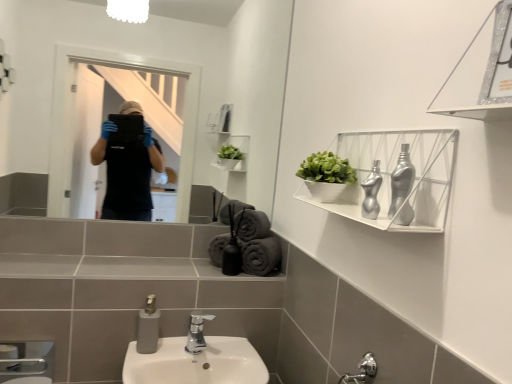
The width and height of the screenshot is (512, 384). What do you see at coordinates (481, 74) in the screenshot? I see `metallic silver shelf at upper right, marked as the 1th shelf in a front-to-back arrangement` at bounding box center [481, 74].

Measure the distance between point (435, 154) and camera.

The distance of point (435, 154) from camera is 33.31 inches.

Describe the element at coordinates (392, 176) in the screenshot. I see `white matte shelf at upper right, the first shelf viewed from the back` at that location.

What are the coordinates of `gray cotton bath towel at center, which ranks as the 4th bath towel in right-to-left order` in the screenshot? It's located at (218, 248).

At what (x,y) coordinates should I click in order to perform the action: click on gray matte bath towel at center, the 2th bath towel from the left. Please return your answer as a coordinate pair (x, y). Looking at the image, I should click on pyautogui.click(x=246, y=244).

You are a GUI agent. You are given a task and a screenshot of the screen. Output one action in this format:
    pyautogui.click(x=<x>, y=<y>)
    Task: Click on the polished chrome faucet at center
    Image resolution: width=512 pixels, height=384 pixels.
    Given the screenshot: What is the action you would take?
    pyautogui.click(x=197, y=332)

Identify the location of gray cotton bath towel at center, the third bath towel viewed from the left. Image resolution: width=512 pixels, height=384 pixels. (251, 225).

In order to face gray cotton bath towel at center, which is the 2th bath towel in right-to-left order, should I rotate leftwards or rightwards?

You should look left and rotate roughly 0.513 degrees.

The width and height of the screenshot is (512, 384). Find the location of `metallic silver shelf at upper right, marked as the 1th shelf in a front-to-back arrangement`. metallic silver shelf at upper right, marked as the 1th shelf in a front-to-back arrangement is located at coordinates point(481,74).

Based on their sizes in the image, would you say gray cotton bath towel at center, which ranks as the 4th bath towel in right-to-left order, is bigger or smaller than gray cotton towels at lower center, marked as the 1th bath towel in a right-to-left arrangement?

Considering their sizes, gray cotton bath towel at center, which ranks as the 4th bath towel in right-to-left order, takes up less space than gray cotton towels at lower center, marked as the 1th bath towel in a right-to-left arrangement.

Considering the relative sizes of gray cotton bath towel at center, which ranks as the 4th bath towel in right-to-left order, and gray cotton towels at lower center, the 4th bath towel viewed from the left, in the image provided, is gray cotton bath towel at center, which ranks as the 4th bath towel in right-to-left order, shorter than gray cotton towels at lower center, the 4th bath towel viewed from the left,?

Incorrect, the height of gray cotton bath towel at center, which ranks as the 4th bath towel in right-to-left order, does not fall short of that of gray cotton towels at lower center, the 4th bath towel viewed from the left.

Identify the location of the 1st bath towel above the gray cotton towels at lower center, marked as the 1th bath towel in a right-to-left arrangement (from the image's perspective). (218, 248).

Based on the photo, from the image's perspective, is gray cotton bath towel at center, acting as the first bath towel starting from the left, on gray cotton towels at lower center, marked as the 1th bath towel in a right-to-left arrangement?

Yes.

From a real-world perspective, is gray matte bath towel at center, which is the third bath towel from right to left, positioned above or below gray cotton towels at lower center, marked as the 1th bath towel in a right-to-left arrangement?

Clearly, from a real-world perspective, gray matte bath towel at center, which is the third bath towel from right to left, is above gray cotton towels at lower center, marked as the 1th bath towel in a right-to-left arrangement.

Between gray matte bath towel at center, which is the third bath towel from right to left, and gray cotton towels at lower center, marked as the 1th bath towel in a right-to-left arrangement, which one has larger width?

Wider between the two is gray cotton towels at lower center, marked as the 1th bath towel in a right-to-left arrangement.

Is gray matte bath towel at center, which is the third bath towel from right to left, turned away from gray cotton towels at lower center, marked as the 1th bath towel in a right-to-left arrangement?

gray matte bath towel at center, which is the third bath towel from right to left, is not turned away from gray cotton towels at lower center, marked as the 1th bath towel in a right-to-left arrangement.

Considering the positions of objects gray matte bath towel at center, which is the third bath towel from right to left, and gray cotton towels at lower center, the 4th bath towel viewed from the left, in the image provided, who is more to the left, gray matte bath towel at center, which is the third bath towel from right to left, or gray cotton towels at lower center, the 4th bath towel viewed from the left,?

gray matte bath towel at center, which is the third bath towel from right to left, is more to the left.

Is point (200, 350) more distant than point (497, 25)?

Yes, it is behind point (497, 25).

Is polished chrome faucet at center turned away from metallic silver shelf at upper right, marked as the 1th shelf in a front-to-back arrangement?

No, polished chrome faucet at center is not facing the opposite direction of metallic silver shelf at upper right, marked as the 1th shelf in a front-to-back arrangement.

From the image's perspective, between polished chrome faucet at center and metallic silver shelf at upper right, marked as the 1th shelf in a front-to-back arrangement, which one is located above?

metallic silver shelf at upper right, marked as the 1th shelf in a front-to-back arrangement, is shown above in the image.

Which of these two, polished chrome faucet at center or metallic silver shelf at upper right, marked as the 1th shelf in a front-to-back arrangement, stands shorter?

With less height is polished chrome faucet at center.

Does gray cotton bath towel at center, which ranks as the 4th bath towel in right-to-left order, have a greater width compared to polished chrome faucet at center?

In fact, gray cotton bath towel at center, which ranks as the 4th bath towel in right-to-left order, might be narrower than polished chrome faucet at center.

From the image's perspective, relative to polished chrome faucet at center, is gray cotton bath towel at center, acting as the first bath towel starting from the left, above or below?

Clearly, from the image's perspective, gray cotton bath towel at center, acting as the first bath towel starting from the left, is above polished chrome faucet at center.

Which object is positioned more to the right, gray cotton bath towel at center, which ranks as the 4th bath towel in right-to-left order, or polished chrome faucet at center?

gray cotton bath towel at center, which ranks as the 4th bath towel in right-to-left order, is more to the right.

Which object is closer to the camera, gray cotton bath towel at center, acting as the first bath towel starting from the left, or polished chrome faucet at center?

polished chrome faucet at center is more forward.

From the picture: From the image's perspective, is white matte shelf at upper right, the first shelf viewed from the back, beneath gray matte bath towel at center, the 2th bath towel from the left?

No.

Is white matte shelf at upper right, which is counted as the 2th shelf, starting from the front, thinner than gray matte bath towel at center, the 2th bath towel from the left?

No, white matte shelf at upper right, which is counted as the 2th shelf, starting from the front, is not thinner than gray matte bath towel at center, the 2th bath towel from the left.

Consider the image. Considering the relative positions of white matte shelf at upper right, the first shelf viewed from the back, and gray matte bath towel at center, which is the third bath towel from right to left, in the image provided, is white matte shelf at upper right, the first shelf viewed from the back, to the left or to the right of gray matte bath towel at center, which is the third bath towel from right to left,?

white matte shelf at upper right, the first shelf viewed from the back, is to the right of gray matte bath towel at center, which is the third bath towel from right to left.

Where is `the 3rd bath towel counting from the left side of the white matte shelf at upper right, the first shelf viewed from the back`? the 3rd bath towel counting from the left side of the white matte shelf at upper right, the first shelf viewed from the back is located at coordinates (246, 244).

From a real-world perspective, who is located higher, metallic silver shelf at upper right, the second shelf viewed from the back, or gray matte soap dispenser at lower center?

From a 3D spatial view, metallic silver shelf at upper right, the second shelf viewed from the back, is above.

Between metallic silver shelf at upper right, the second shelf viewed from the back, and gray matte soap dispenser at lower center, which one has larger width?

Wider between the two is metallic silver shelf at upper right, the second shelf viewed from the back.

Can you confirm if metallic silver shelf at upper right, marked as the 1th shelf in a front-to-back arrangement, is positioned to the left of gray matte soap dispenser at lower center?

No.

How many degrees apart are the facing directions of white matte shelf at upper right, which is counted as the 2th shelf, starting from the front, and gray matte soap dispenser at lower center?

The angular difference between white matte shelf at upper right, which is counted as the 2th shelf, starting from the front, and gray matte soap dispenser at lower center is 89.1 degrees.

Does white matte shelf at upper right, which is counted as the 2th shelf, starting from the front, have a lesser height compared to gray matte soap dispenser at lower center?

No, white matte shelf at upper right, which is counted as the 2th shelf, starting from the front, is not shorter than gray matte soap dispenser at lower center.

Considering the relative positions of white matte shelf at upper right, the first shelf viewed from the back, and gray matte soap dispenser at lower center in the image provided, is white matte shelf at upper right, the first shelf viewed from the back, behind gray matte soap dispenser at lower center?

No, it is in front of gray matte soap dispenser at lower center.

From a real-world perspective, is white matte shelf at upper right, the first shelf viewed from the back, below gray matte soap dispenser at lower center?

Actually, white matte shelf at upper right, the first shelf viewed from the back, is physically above gray matte soap dispenser at lower center in the real world.

The width and height of the screenshot is (512, 384). I want to click on the 1st bath towel above the gray cotton towels at lower center, the 4th bath towel viewed from the left (from the image's perspective), so click(x=218, y=248).

At what (x,y) coordinates should I click in order to perform the action: click on the 1st bath towel behind when counting from the gray matte bath towel at center, which is the third bath towel from right to left. Please return your answer as a coordinate pair (x, y). The height and width of the screenshot is (384, 512). Looking at the image, I should click on (261, 256).

Estimate the real-world distances between objects in this image. Which object is further from gray matte bath towel at center, which is the third bath towel from right to left, gray matte soap dispenser at lower center or polished chrome faucet at center?

The object further to gray matte bath towel at center, which is the third bath towel from right to left, is gray matte soap dispenser at lower center.

From the picture: When comparing their distances from gray matte soap dispenser at lower center, does white matte shelf at upper right, the first shelf viewed from the back, or gray cotton bath towel at center, acting as the first bath towel starting from the left, seem closer?

gray cotton bath towel at center, acting as the first bath towel starting from the left.

Looking at the image, which one is located further to polished chrome faucet at center, gray matte soap dispenser at lower center or white matte shelf at upper right, the first shelf viewed from the back?

white matte shelf at upper right, the first shelf viewed from the back, is positioned further to the anchor polished chrome faucet at center.

When comparing their distances from polished chrome faucet at center, does gray cotton bath towel at center, acting as the first bath towel starting from the left, or gray matte bath towel at center, the 2th bath towel from the left, seem further?

gray matte bath towel at center, the 2th bath towel from the left.

Considering their positions, is gray cotton bath towel at center, the third bath towel viewed from the left, positioned further to gray matte bath towel at center, the 2th bath towel from the left, than gray cotton bath towel at center, which ranks as the 4th bath towel in right-to-left order?

The object further to gray matte bath towel at center, the 2th bath towel from the left, is gray cotton bath towel at center, which ranks as the 4th bath towel in right-to-left order.

Looking at the image, which one is located further to gray cotton towels at lower center, the 4th bath towel viewed from the left, metallic silver shelf at upper right, the second shelf viewed from the back, or gray matte bath towel at center, which is the third bath towel from right to left?

The object further to gray cotton towels at lower center, the 4th bath towel viewed from the left, is metallic silver shelf at upper right, the second shelf viewed from the back.

Which object lies further to the anchor point polished chrome faucet at center, gray matte bath towel at center, the 2th bath towel from the left, or gray cotton bath towel at center, which is the 2th bath towel in right-to-left order?

gray cotton bath towel at center, which is the 2th bath towel in right-to-left order, is positioned further to the anchor polished chrome faucet at center.

Which object lies nearer to the anchor point gray matte soap dispenser at lower center, gray cotton towels at lower center, marked as the 1th bath towel in a right-to-left arrangement, or gray cotton bath towel at center, acting as the first bath towel starting from the left?

gray cotton bath towel at center, acting as the first bath towel starting from the left, is closer to gray matte soap dispenser at lower center.

This screenshot has width=512, height=384. What are the coordinates of `tap between metallic silver shelf at upper right, the second shelf viewed from the back, and gray matte bath towel at center, which is the third bath towel from right to left, along the z-axis` in the screenshot? It's located at click(197, 332).

Locate an element on the screen. soap dispenser between metallic silver shelf at upper right, marked as the 1th shelf in a front-to-back arrangement, and gray cotton towels at lower center, the 4th bath towel viewed from the left, from front to back is located at coordinates (148, 327).

The width and height of the screenshot is (512, 384). What are the coordinates of `shelf located between metallic silver shelf at upper right, the second shelf viewed from the back, and polished chrome faucet at center in the depth direction` in the screenshot? It's located at (392, 176).

Image resolution: width=512 pixels, height=384 pixels. Identify the location of soap dispenser between white matte shelf at upper right, which is counted as the 2th shelf, starting from the front, and gray cotton towels at lower center, marked as the 1th bath towel in a right-to-left arrangement, in the front-back direction. (148, 327).